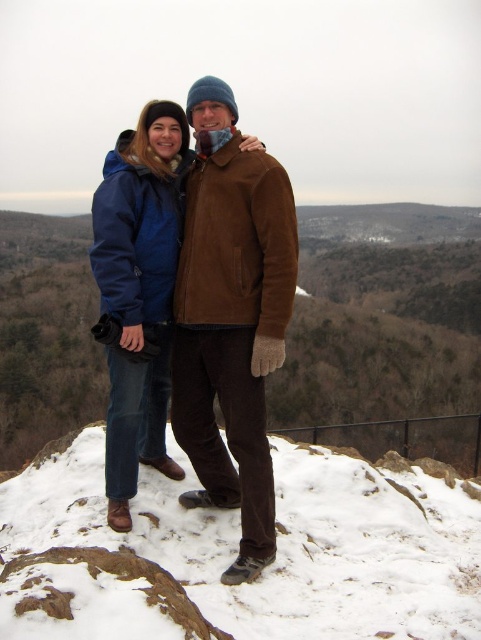
You are planning to place a small wooden bench in the scene. The bench is 1 meter wide. Considering the white powdery snow at center and the brown suede jacket at center, which object can the bench fit next to without overlapping?

The white powdery snow at center has a greater width than the brown suede jacket at center, so the bench can fit next to the white powdery snow at center without overlapping.

You are planning to place a small flag on the white powdery snow at center. The flag needs to be placed at the same height as the brown suede jacket at center. Is this possible?

The white powdery snow at center is located below brown suede jacket at center, so placing the flag at the same height as the brown suede jacket at center would require placing it higher than the snow, which is not possible since the snow is the surface where the flag can be placed.

You are a photographer trying to capture a shot of the two people in the scene. You want to ensure that the white powdery snow at center and the brown suede jacket at center are both visible in the frame. Which object should you focus on first to ensure both are in focus?

The brown suede jacket at center is taller than the white powdery snow at center, so focusing on the taller object first would help ensure both are in focus.